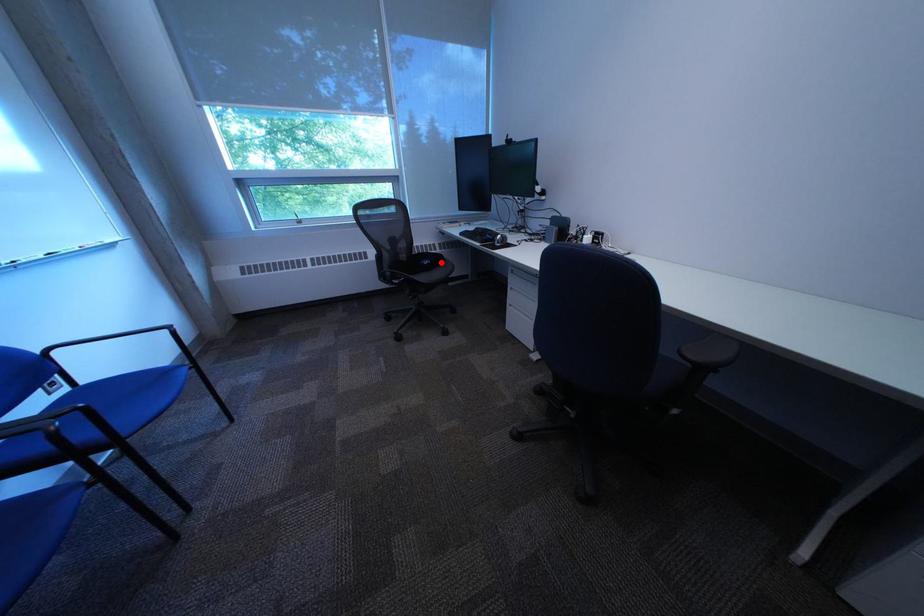
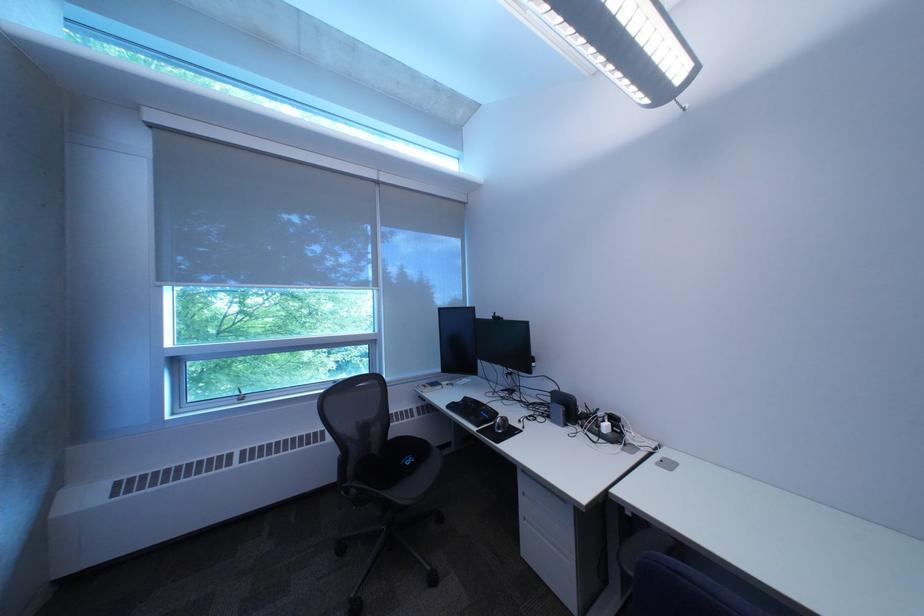
Question: A red point is marked in image1. In image2, is the corresponding 3D point closer to the camera or farther? Reply with the corresponding letter.

Choices:
 (A) The corresponding 3D point is closer.
 (B) The corresponding 3D point is farther.

Answer: (B)